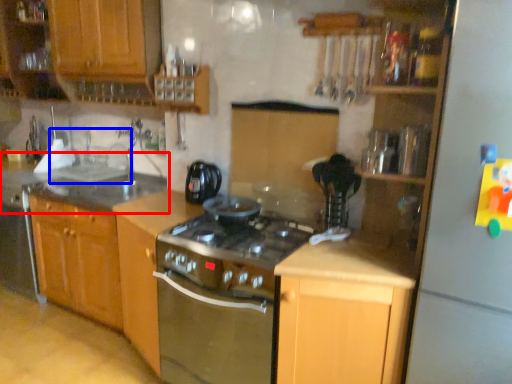
Question: Which object is closer to the camera taking this photo, countertop (highlighted by a red box) or sink (highlighted by a blue box)?

Choices:
 (A) countertop
 (B) sink

Answer: (A)